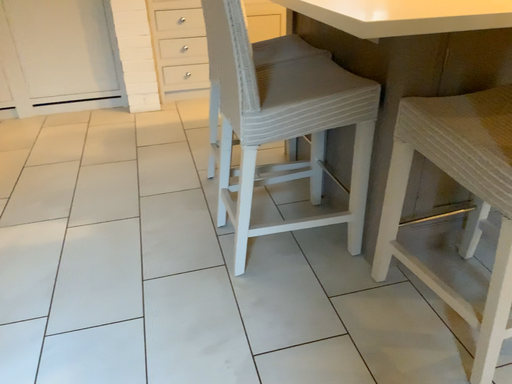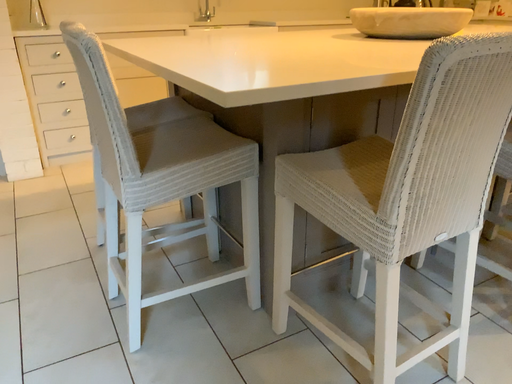
Question: Which way did the camera rotate in the video?

Choices:
 (A) rotated left
 (B) rotated right

Answer: (B)